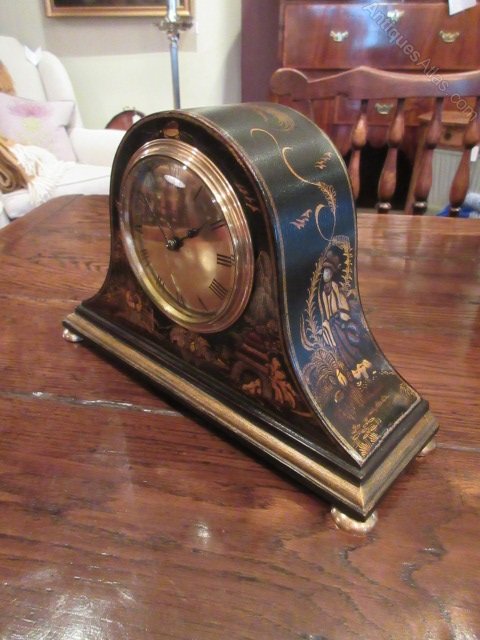
Find the location of a particular element. The width and height of the screenshot is (480, 640). white couch is located at coordinates (31, 86).